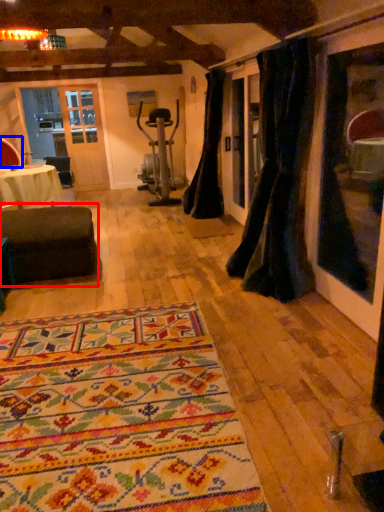
Question: Which of the following is the closest to the observer, studio couch (highlighted by a red box) or armchair (highlighted by a blue box)?

Choices:
 (A) studio couch
 (B) armchair

Answer: (A)